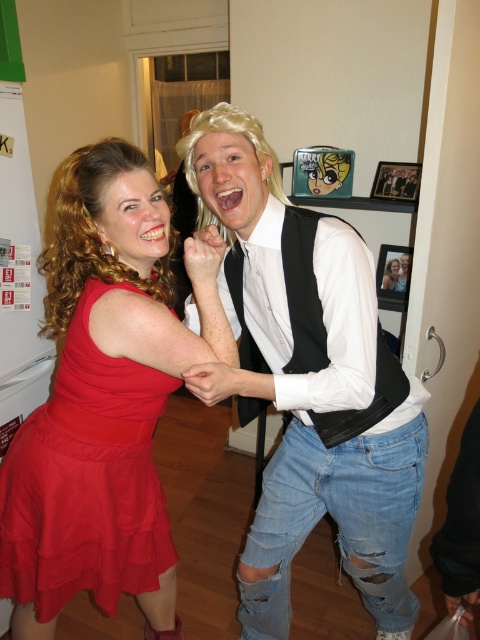
Is the position of white matte vest at center less distant than that of red chiffon skirt at left?

Yes, white matte vest at center is closer to the viewer.

Identify the location of white matte vest at center. The width and height of the screenshot is (480, 640). (308, 381).

Find the location of `white matte vest at center`. white matte vest at center is located at coordinates (308, 381).